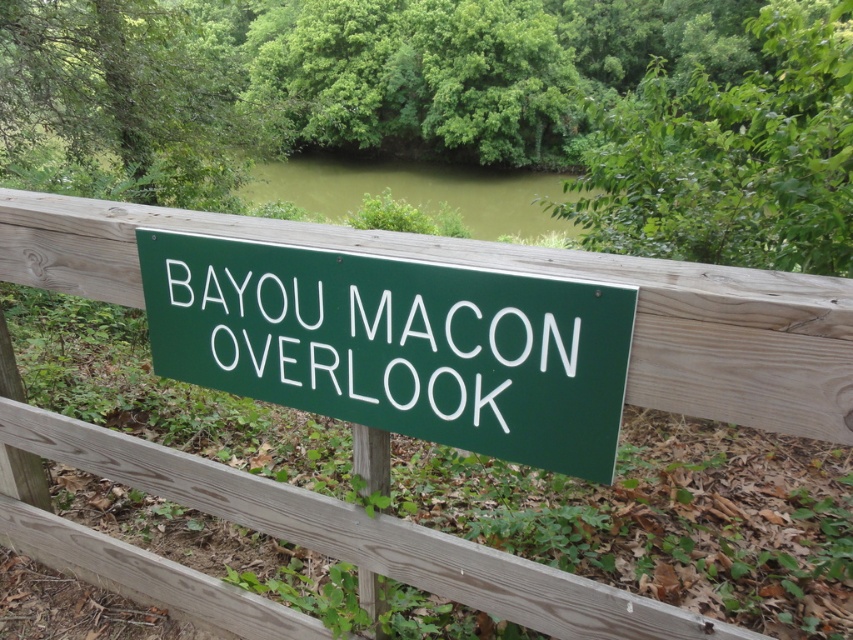
Is green painted wood sign at center thinner than green wood fence at center?

Yes, green painted wood sign at center is thinner than green wood fence at center.

Locate an element on the screen. Image resolution: width=853 pixels, height=640 pixels. green painted wood sign at center is located at coordinates (397, 344).

Who is taller, green painted wood sign at center or green murky water at upper center?

green murky water at upper center is taller.

Is point (502, 435) farther from camera compared to point (544, 209)?

That is False.

Locate an element on the screen. Image resolution: width=853 pixels, height=640 pixels. green painted wood sign at center is located at coordinates (397, 344).

Can you confirm if green wood fence at center is bigger than green murky water at upper center?

Incorrect, green wood fence at center is not larger than green murky water at upper center.

In the scene shown: How far apart are green wood fence at center and green murky water at upper center?

The distance of green wood fence at center from green murky water at upper center is 19.03 meters.

Measure the distance between point (817, 380) and camera.

Point (817, 380) and camera are 3.82 feet apart from each other.

This screenshot has width=853, height=640. What are the coordinates of `green wood fence at center` in the screenshot? It's located at (524, 272).